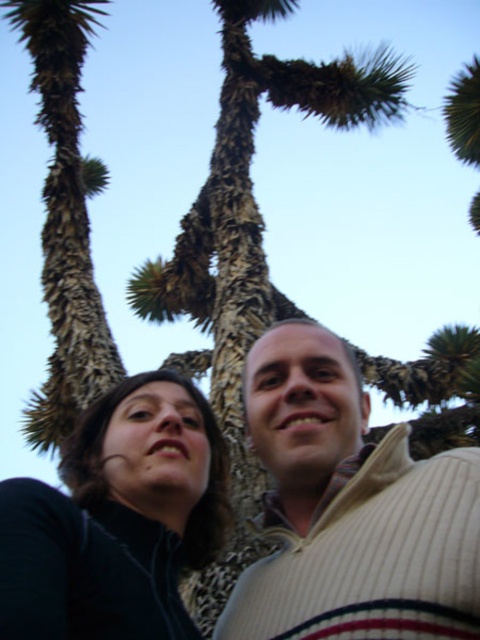
Looking at this image, you are taking a photo of two points in the image. The first point is at coordinates point [186,490] and the second is at point [169,381]. Which point will appear larger in your photo?

Point [186,490] is closer to the camera than point [169,381], so it will appear larger in the photo.

You are standing at the point marked by the coordinates point (350, 509) in the image. What object is located at that point?

The point (350, 509) marks the dark brown sweater at center.

You are a photographer trying to capture the two subjects in the scene. Given that the black matte jacket at lower left is shorter than the brown textured trunk at left, how should you adjust your camera angle to ensure both are fully visible in the frame?

Since the black matte jacket at lower left is shorter than the brown textured trunk at left, you should lower your camera angle to include the full height of both the black matte jacket at lower left and the brown textured trunk at left in the frame.